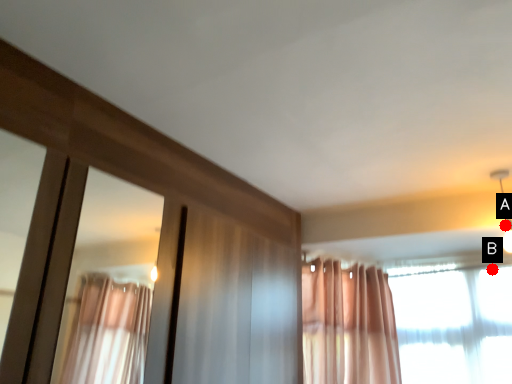
Question: Two points are circled on the image, labeled by A and B beside each circle. Among these points, which one is farthest from the camera?

Choices:
 (A) A is further
 (B) B is further

Answer: (B)